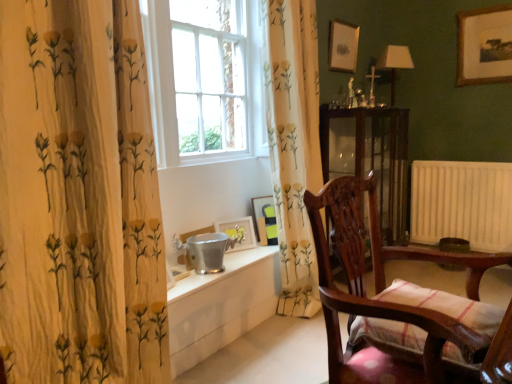
Measure the distance between point (488, 205) and camera.

Point (488, 205) and camera are 3.22 meters apart.

At what (x,y) coordinates should I click in order to perform the action: click on transparent glass cabinet at center. Please return your answer as a coordinate pair (x, y). Looking at the image, I should click on pyautogui.click(x=371, y=158).

Locate an element on the screen. matte silver picture frame at lower center, positioned as the second picture frame in left-to-right order is located at coordinates (238, 233).

The width and height of the screenshot is (512, 384). I want to click on metallic silver picture frame at lower center, the fifth picture frame in the right-to-left sequence, so click(x=196, y=233).

The image size is (512, 384). Identify the location of white floral-patterned curtain at left, the second curtain positioned from the right. (79, 197).

The image size is (512, 384). What do you see at coordinates (394, 63) in the screenshot? I see `matte white lampshade at right` at bounding box center [394, 63].

Where is `white glass window at center`? Image resolution: width=512 pixels, height=384 pixels. white glass window at center is located at coordinates (202, 88).

Between white glass window at center and transparent glass cabinet at center, which one has smaller width?

white glass window at center is thinner.

Is white glass window at center positioned beyond the bounds of transparent glass cabinet at center?

Indeed, white glass window at center is completely outside transparent glass cabinet at center.

Can you confirm if white glass window at center is smaller than transparent glass cabinet at center?

Yes.

Would you say metallic silver picture frame at lower center, positioned as the 5th picture frame in top-to-bottom order, is a long distance from floral fabric curtain at center, which appears as the 2th curtain when viewed from the front?

They are positioned close to each other.

In terms of size, does metallic silver picture frame at lower center, positioned as the 5th picture frame in top-to-bottom order, appear bigger or smaller than floral fabric curtain at center, placed as the first curtain when sorted from back to front?

Clearly, metallic silver picture frame at lower center, positioned as the 5th picture frame in top-to-bottom order, is smaller in size than floral fabric curtain at center, placed as the first curtain when sorted from back to front.

What's the angular difference between metallic silver picture frame at lower center, the 1th picture frame positioned from the bottom, and floral fabric curtain at center, which appears as the 2th curtain when viewed from the front,'s facing directions?

metallic silver picture frame at lower center, the 1th picture frame positioned from the bottom, and floral fabric curtain at center, which appears as the 2th curtain when viewed from the front, are facing 1.65 degrees away from each other.

Is metallic silver picture frame at lower center, the 1th picture frame positioned from the bottom, taller than floral fabric curtain at center, which appears as the second curtain when viewed from the left?

No.

How far apart are matte white lampshade at right and wooden chair with striped cushion at right?

8.50 feet.

Between matte white lampshade at right and wooden chair with striped cushion at right, which one is positioned in front?

wooden chair with striped cushion at right.

What's the angular difference between matte white lampshade at right and wooden chair with striped cushion at right's facing directions?

They differ by 36.3 degrees in their facing directions.

From a real-world perspective, between matte white lampshade at right and wooden chair with striped cushion at right, who is vertically higher?

In real-world perspective, matte white lampshade at right is above.

Which object is thinner, metallic silver picture frame at lower center, which appears as the first picture frame when viewed from the left, or wooden picture frame at lower center, which ranks as the 3th picture frame in left-to-right order?

metallic silver picture frame at lower center, which appears as the first picture frame when viewed from the left.

From a real-world perspective, between metallic silver picture frame at lower center, positioned as the 5th picture frame in top-to-bottom order, and wooden picture frame at lower center, which appears as the 3th picture frame when viewed from the top, who is vertically lower?

metallic silver picture frame at lower center, positioned as the 5th picture frame in top-to-bottom order, is physically lower.

Does metallic silver picture frame at lower center, positioned as the 5th picture frame in top-to-bottom order, have a smaller size compared to wooden picture frame at lower center, which ranks as the 3th picture frame in left-to-right order?

Correct, metallic silver picture frame at lower center, positioned as the 5th picture frame in top-to-bottom order, occupies less space than wooden picture frame at lower center, which ranks as the 3th picture frame in left-to-right order.

Considering the sizes of objects wooden framed picture at upper right, which ranks as the first picture frame in right-to-left order, and metallic silver picture frame at lower center, which appears as the first picture frame when viewed from the left, in the image provided, who is wider, wooden framed picture at upper right, which ranks as the first picture frame in right-to-left order, or metallic silver picture frame at lower center, which appears as the first picture frame when viewed from the left,?

metallic silver picture frame at lower center, which appears as the first picture frame when viewed from the left.

Considering the sizes of objects wooden framed picture at upper right, the fifth picture frame positioned from the bottom, and metallic silver picture frame at lower center, the 1th picture frame positioned from the bottom, in the image provided, who is bigger, wooden framed picture at upper right, the fifth picture frame positioned from the bottom, or metallic silver picture frame at lower center, the 1th picture frame positioned from the bottom,?

Bigger between the two is wooden framed picture at upper right, the fifth picture frame positioned from the bottom.

Is wooden framed picture at upper right, which is the 5th picture frame from left to right, closer to camera compared to metallic silver picture frame at lower center, the fifth picture frame in the right-to-left sequence?

No, wooden framed picture at upper right, which is the 5th picture frame from left to right, is further to the viewer.

Between wooden picture frame at lower center, arranged as the third picture frame when viewed from the right, and wooden chair with striped cushion at right, which one has more height?

With more height is wooden chair with striped cushion at right.

Identify the location of furniture on the right of wooden picture frame at lower center, which appears as the 3th picture frame when viewed from the top. The image size is (512, 384). (395, 301).

From a real-world perspective, is wooden picture frame at lower center, arranged as the third picture frame when viewed from the right, under wooden chair with striped cushion at right?

Actually, wooden picture frame at lower center, arranged as the third picture frame when viewed from the right, is physically above wooden chair with striped cushion at right in the real world.

From the image's perspective, which object appears higher, wooden picture frame at lower center, arranged as the third picture frame when viewed from the right, or wooden chair with striped cushion at right?

wooden picture frame at lower center, arranged as the third picture frame when viewed from the right, is shown above in the image.

How many degrees apart are the facing directions of matte white lampshade at right and wooden picture frame at lower center, placed as the third picture frame when sorted from bottom to top?

The angle between the facing direction of matte white lampshade at right and the facing direction of wooden picture frame at lower center, placed as the third picture frame when sorted from bottom to top, is 13.4 degrees.

Which of these two, matte white lampshade at right or wooden picture frame at lower center, which appears as the 3th picture frame when viewed from the top, is thinner?

Thinner between the two is wooden picture frame at lower center, which appears as the 3th picture frame when viewed from the top.

From a real-world perspective, which is physically below, matte white lampshade at right or wooden picture frame at lower center, arranged as the third picture frame when viewed from the right?

wooden picture frame at lower center, arranged as the third picture frame when viewed from the right, from a real-world perspective.

Identify the location of the 3rd picture frame in front of the matte white lampshade at right. (265, 220).

Identify the location of window above the transparent glass cabinet at center (from the image's perspective). (202, 88).

The height and width of the screenshot is (384, 512). I want to click on curtain lying on the right of metallic silver picture frame at lower center, the fifth picture frame in the right-to-left sequence, so click(x=293, y=143).

From the image, which object appears to be farther from wooden chair with striped cushion at right, floral fabric curtain at center, which appears as the first curtain when viewed from the right, or matte white picture frame at upper center, the second picture frame in the right-to-left sequence?

The object further to wooden chair with striped cushion at right is matte white picture frame at upper center, the second picture frame in the right-to-left sequence.

Based on the photo, looking at the image, which one is located closer to wooden chair with striped cushion at right, white floral-patterned curtain at left, the second curtain positioned from the right, or white painted radiator at right?

white floral-patterned curtain at left, the second curtain positioned from the right.

Which object lies further to the anchor point metallic silver picture frame at lower center, positioned as the 5th picture frame in top-to-bottom order, floral fabric curtain at center, which appears as the 2th curtain when viewed from the front, or matte silver picture frame at lower center, placed as the fourth picture frame when sorted from top to bottom?

floral fabric curtain at center, which appears as the 2th curtain when viewed from the front.

Which object lies further to the anchor point white floral-patterned curtain at left, which appears as the 1th curtain when viewed from the front, transparent glass cabinet at center or floral fabric curtain at center, which appears as the second curtain when viewed from the left?

transparent glass cabinet at center lies further to white floral-patterned curtain at left, which appears as the 1th curtain when viewed from the front, than the other object.

Looking at this image, estimate the real-world distances between objects in this image. Which object is closer to white glossy table at lower center, wooden framed picture at upper right, which is the 5th picture frame from left to right, or matte silver picture frame at lower center, placed as the fourth picture frame when sorted from top to bottom?

matte silver picture frame at lower center, placed as the fourth picture frame when sorted from top to bottom.

From the image, which object appears to be farther from white floral-patterned curtain at left, the second curtain viewed from the back, white painted radiator at right or transparent glass cabinet at center?

Based on the image, white painted radiator at right appears to be further to white floral-patterned curtain at left, the second curtain viewed from the back.

From the image, which object appears to be nearer to wooden framed picture at upper right, the fifth picture frame positioned from the bottom, matte silver picture frame at lower center, placed as the fourth picture frame when sorted from top to bottom, or metallic silver picture frame at lower center, the fifth picture frame in the right-to-left sequence?

matte silver picture frame at lower center, placed as the fourth picture frame when sorted from top to bottom, is positioned closer to the anchor wooden framed picture at upper right, the fifth picture frame positioned from the bottom.

Considering their positions, is wooden picture frame at lower center, arranged as the third picture frame when viewed from the right, positioned closer to white glossy table at lower center than floral fabric curtain at center, which appears as the second curtain when viewed from the left?

wooden picture frame at lower center, arranged as the third picture frame when viewed from the right, lies closer to white glossy table at lower center than the other object.

In order to click on screen door positioned between wooden chair with striped cushion at right and wooden framed picture at upper right, which is the 5th picture frame from left to right, from near to far in this screenshot , I will do `click(371, 158)`.

Where is `radiator situated between white glossy table at lower center and wooden framed picture at upper right, which is the 5th picture frame from left to right, from left to right`? radiator situated between white glossy table at lower center and wooden framed picture at upper right, which is the 5th picture frame from left to right, from left to right is located at coordinates (462, 203).

I want to click on screen door located between matte silver picture frame at lower center, positioned as the second picture frame in left-to-right order, and wooden framed picture at upper right, which is the 1th picture frame in top-to-bottom order, in the left-right direction, so click(x=371, y=158).

Locate an element on the screen. Image resolution: width=512 pixels, height=384 pixels. screen door between matte silver picture frame at lower center, which is the fourth picture frame from right to left, and matte white lampshade at right, in the horizontal direction is located at coordinates (371, 158).